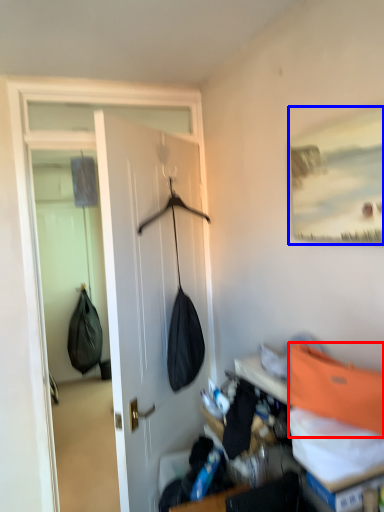
Question: Among these objects, which one is farthest to the camera, shoulder bag (highlighted by a red box) or picture frame (highlighted by a blue box)?

Choices:
 (A) shoulder bag
 (B) picture frame

Answer: (B)